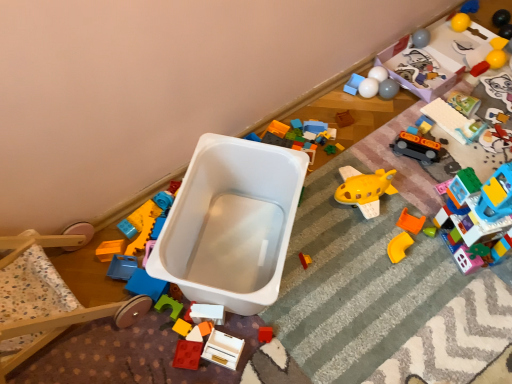
This screenshot has width=512, height=384. I want to click on free space in front of matte yellow toy airplane at center, arranged as the 5th toy when viewed from the left, so click(308, 322).